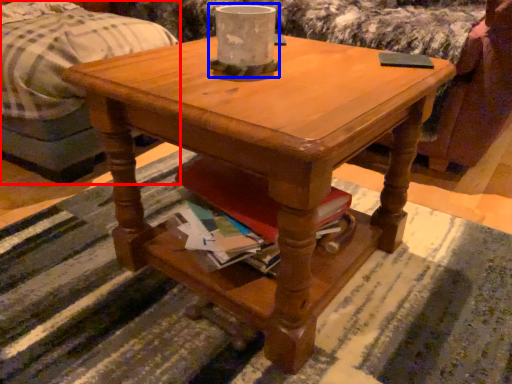
Question: Among these objects, which one is nearest to the camera, bed (highlighted by a red box) or candle holder (highlighted by a blue box)?

Choices:
 (A) bed
 (B) candle holder

Answer: (B)